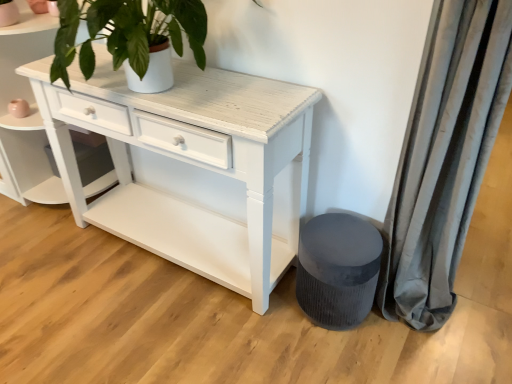
Find the location of `velvet grey stool at lower right`. velvet grey stool at lower right is located at coordinates (338, 269).

In order to face white distressed wood shelf at center, should I rotate leftwards or rightwards?

Turn left approximately 24.198 degrees to face it.

You are a GUI agent. You are given a task and a screenshot of the screen. Output one action in this format:
    pyautogui.click(x=<x>, y=<y>)
    Task: Click on the velvet grey stool at lower right
    Image resolution: width=512 pixels, height=384 pixels.
    Given the screenshot: What is the action you would take?
    pyautogui.click(x=338, y=269)

Is point (13, 149) closer to camera compared to point (369, 234)?

No.

Does white distressed wood shelf at center contain velvet grey stool at lower right?

Definitely not — velvet grey stool at lower right is not inside white distressed wood shelf at center.

From a real-world perspective, who is located higher, white distressed wood shelf at center or velvet grey stool at lower right?

white distressed wood shelf at center.

Consider the image. Is white distressed wood shelf at center far from velvet grey stool at lower right?

white distressed wood shelf at center is positioned a significant distance from velvet grey stool at lower right.

Does point (36, 20) appear closer or farther from the camera than point (492, 52)?

Point (36, 20) is positioned farther from the camera compared to point (492, 52).

Can you confirm if white distressed wood shelf at center is taller than gray velvet curtain at right?

Incorrect, the height of white distressed wood shelf at center is not larger of that of gray velvet curtain at right.

There is a white distressed wood shelf at center. Where is `curtain above it (from a real-world perspective)`? curtain above it (from a real-world perspective) is located at coordinates (445, 157).

From the image's perspective, is velvet grey stool at lower right positioned above or below gray velvet curtain at right?

velvet grey stool at lower right is below gray velvet curtain at right.

Considering the relative sizes of velvet grey stool at lower right and gray velvet curtain at right in the image provided, is velvet grey stool at lower right thinner than gray velvet curtain at right?

In fact, velvet grey stool at lower right might be wider than gray velvet curtain at right.

Is velvet grey stool at lower right spatially inside gray velvet curtain at right, or outside of it?

The correct answer is: outside.

From a real-world perspective, between velvet grey stool at lower right and gray velvet curtain at right, who is vertically higher?

From a 3D spatial view, gray velvet curtain at right is above.

From a real-world perspective, is gray velvet curtain at right over velvet grey stool at lower right?

Yes.

Which object is more forward, gray velvet curtain at right or velvet grey stool at lower right?

Positioned in front is gray velvet curtain at right.

Can you tell me how much gray velvet curtain at right and velvet grey stool at lower right differ in facing direction?

There is a 0.754-degree angle between the facing directions of gray velvet curtain at right and velvet grey stool at lower right.

Is gray velvet curtain at right spatially inside velvet grey stool at lower right, or outside of it?

gray velvet curtain at right is not enclosed by velvet grey stool at lower right.

Would you say velvet grey stool at lower right is to the left or to the right of white distressed wood shelf at center in the picture?

From the image, it's evident that velvet grey stool at lower right is to the right of white distressed wood shelf at center.

From the image's perspective, would you say velvet grey stool at lower right is shown under white distressed wood shelf at center?

Yes, from the image's perspective, velvet grey stool at lower right is below white distressed wood shelf at center.

Considering the points (362, 232) and (62, 197), which point is behind, point (362, 232) or point (62, 197)?

Point (62, 197)

The height and width of the screenshot is (384, 512). There is a velvet grey stool at lower right. Find the location of `shelf above it (from a real-world perspective)`. shelf above it (from a real-world perspective) is located at coordinates (26, 118).

Is gray velvet curtain at right outside of white distressed wood shelf at center?

Yes.

Is white distressed wood shelf at center at the back of gray velvet curtain at right?

No, gray velvet curtain at right is not facing the opposite direction of white distressed wood shelf at center.

Locate an element on the screen. Image resolution: width=512 pixels, height=384 pixels. shelf located above the velvet grey stool at lower right (from a real-world perspective) is located at coordinates (26, 118).

I want to click on curtain lying in front of the white distressed wood shelf at center, so click(x=445, y=157).

When comparing their distances from gray velvet curtain at right, does white distressed wood shelf at center or velvet grey stool at lower right seem further?

Based on the image, white distressed wood shelf at center appears to be further to gray velvet curtain at right.

Based on their spatial positions, is velvet grey stool at lower right or white distressed wood shelf at center further from gray velvet curtain at right?

white distressed wood shelf at center.

Consider the image. Estimate the real-world distances between objects in this image. Which object is closer to white distressed wood shelf at center, gray velvet curtain at right or velvet grey stool at lower right?

velvet grey stool at lower right lies closer to white distressed wood shelf at center than the other object.

Which object lies nearer to the anchor point velvet grey stool at lower right, white distressed wood shelf at center or gray velvet curtain at right?

Among the two, gray velvet curtain at right is located nearer to velvet grey stool at lower right.

Based on their spatial positions, is gray velvet curtain at right or white distressed wood shelf at center closer to velvet grey stool at lower right?

gray velvet curtain at right lies closer to velvet grey stool at lower right than the other object.

Which object lies further to the anchor point white distressed wood shelf at center, velvet grey stool at lower right or gray velvet curtain at right?

The object further to white distressed wood shelf at center is gray velvet curtain at right.

The image size is (512, 384). Find the location of `music stool between white distressed wood shelf at center and gray velvet curtain at right`. music stool between white distressed wood shelf at center and gray velvet curtain at right is located at coordinates (338, 269).